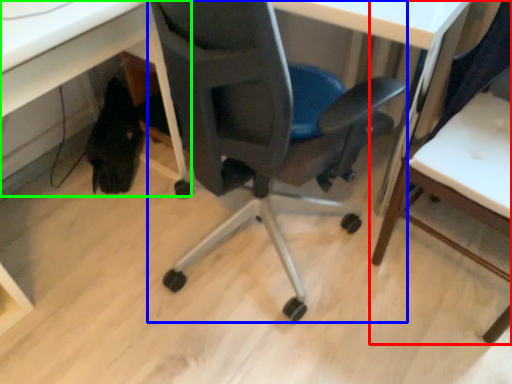
Question: Considering the real-world distances, which object is closest to chair (highlighted by a red box)? chair (highlighted by a blue box) or computer desk (highlighted by a green box).

Choices:
 (A) chair
 (B) computer desk

Answer: (A)